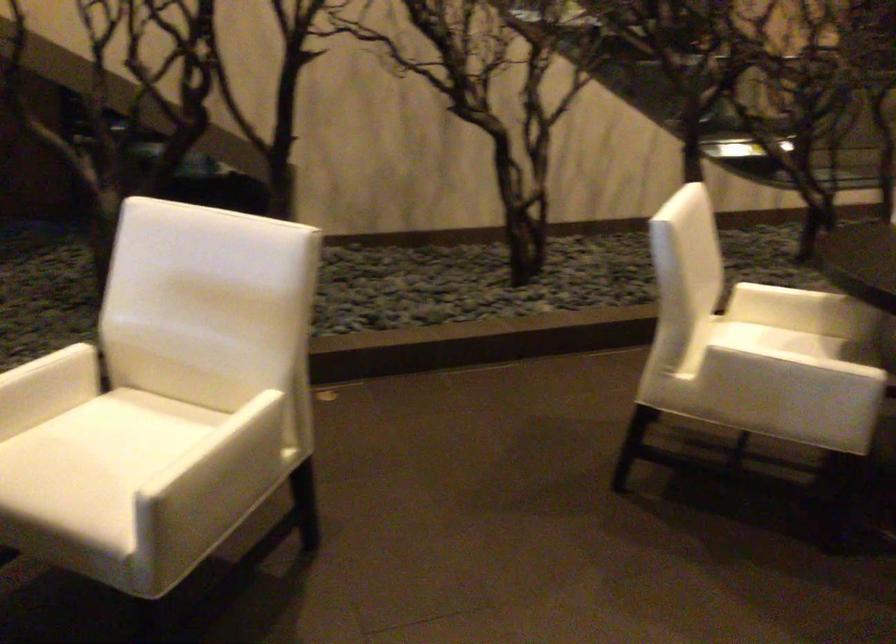
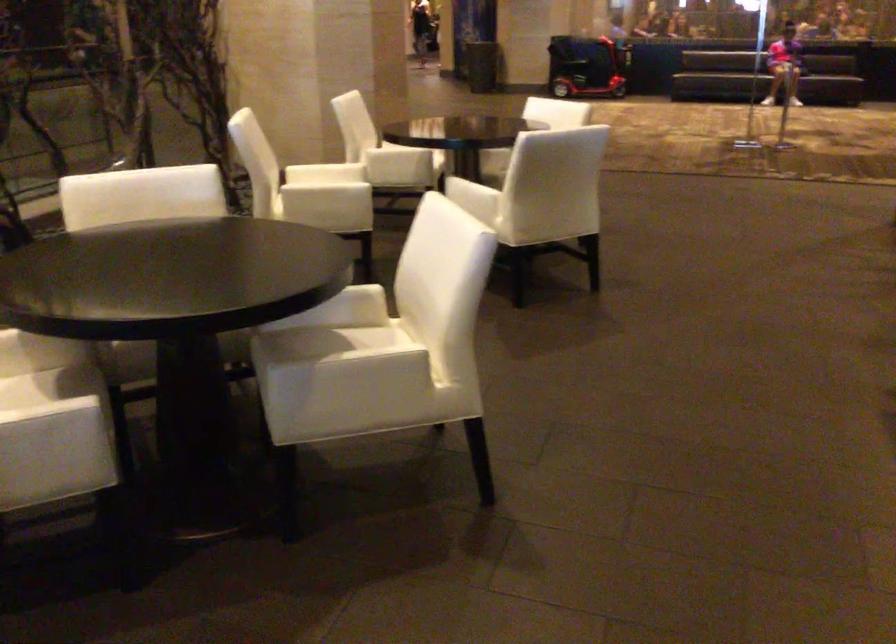
Question: The camera is either moving clockwise (left) or counter-clockwise (right) around the object. The first image is from the beginning of the video and the second image is from the end. Is the camera moving left or right when shooting the video?

Choices:
 (A) Left
 (B) Right

Answer: (A)